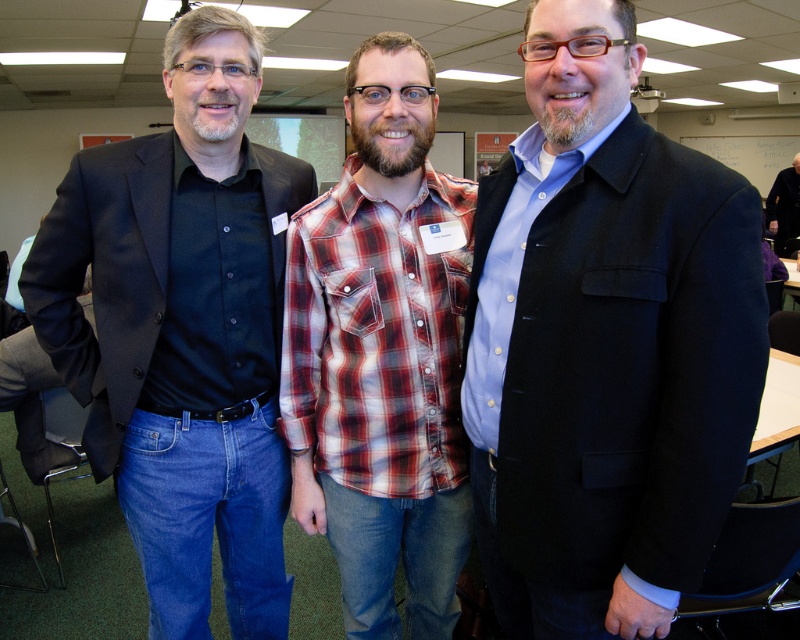
In the conference room scene, there are two men wearing the plaid cotton shirt at center and the dark gray sweater at right. Which one is positioned lower in the image?

The plaid cotton shirt at center is located below dark gray sweater at right, so the plaid cotton shirt at center is positioned lower in the image.

You are organizing a photoshoot and need to ensure that the matte black coat at center and the matte black shirt at left are visible in the frame. Given their sizes, which one might require more careful framing to avoid being too small in the photo?

The matte black coat at center occupies less space than the matte black shirt at left, so it might require more careful framing to avoid being too small in the photo.

You are a photographer setting up for a group photo in the conference room. You need to ensure that all subjects are visible. Given the two central items, the matte black coat at center and the plaid cotton shirt at center, which item is shorter and might block the view of someone behind it?

The matte black coat at center is shorter than the plaid cotton shirt at center, so it might block the view less compared to the taller plaid cotton shirt at center.